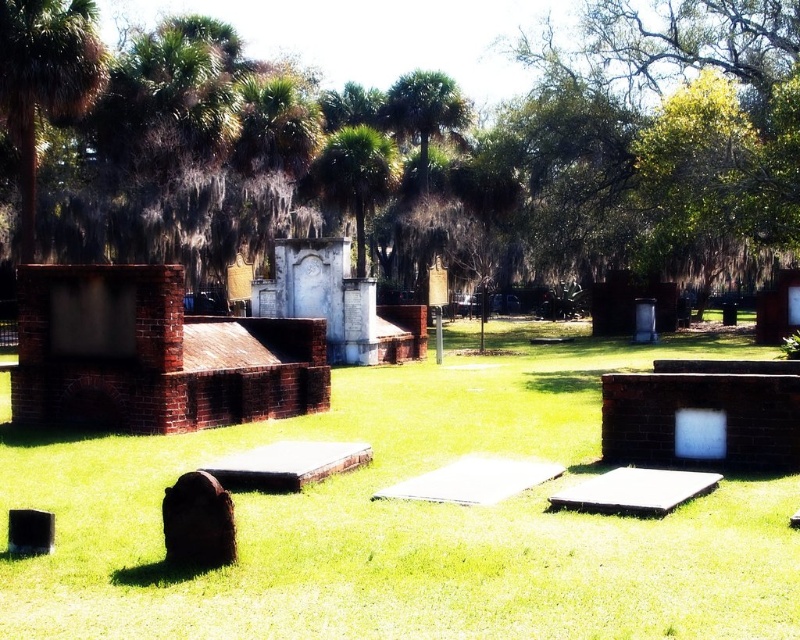
You are a groundskeeper with a lawnmower that has a 20 meter range. You are standing next to the dark brown stone gravestone at lower left and need to mow the grass near the green leafy palm tree at center. Can you reach it without moving your lawnmower?

The distance between the green leafy palm tree at center and the dark brown stone gravestone at lower left is 32.78 meters. Since the lawnmower only has a 20 meter range, you cannot reach the green leafy palm tree at center without moving the lawnmower.

You are standing at the entrance of the cemetery and see the green leafy palm tree at center and the dark brown stone gravestone at lower left. Which object is higher in elevation compared to the other?

The green leafy palm tree at center is above the dark brown stone gravestone at lower left, so the palm tree is higher in elevation.